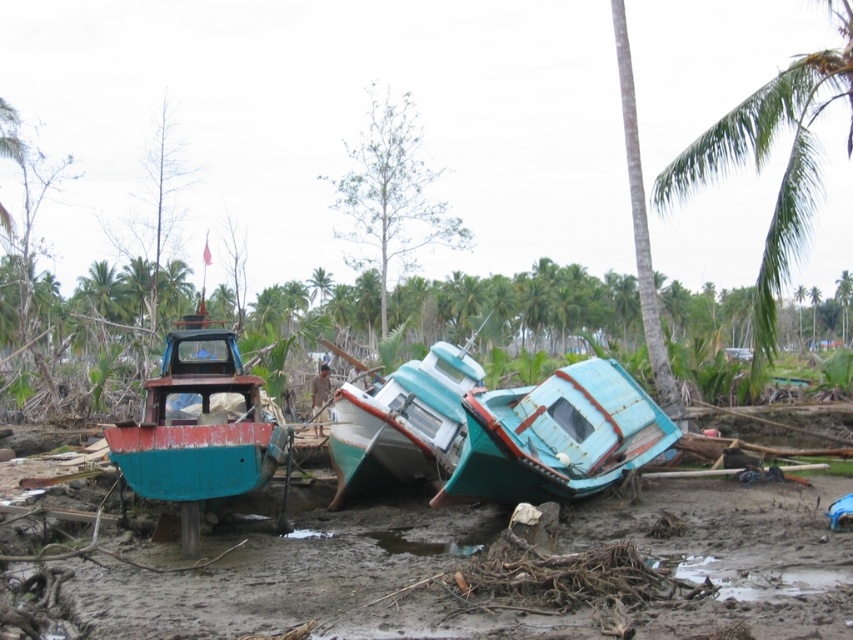
Question: Can you confirm if green leafy palm tree at upper right is thinner than green leafy palm tree at upper center?

Choices:
 (A) no
 (B) yes

Answer: (A)

Question: Which of the following is the farthest from the observer?

Choices:
 (A) green leafy palm tree at upper right
 (B) teal matte boat at center
 (C) rusty metal boat at left
 (D) green leafy palm tree at upper center

Answer: (D)

Question: Among these points, which one is nearest to the camera?

Choices:
 (A) (344, 448)
 (B) (714, 163)

Answer: (A)

Question: Does rusty teal boat at center have a greater width compared to teal matte boat at center?

Choices:
 (A) no
 (B) yes

Answer: (B)

Question: Which object is the closest to the green leafy palm tree at upper right?

Choices:
 (A) rusty metal boat at left
 (B) teal matte boat at center
 (C) green leafy palm tree at upper center
 (D) rusty teal boat at center

Answer: (D)

Question: Is rusty metal boat at left to the left of green leafy palm tree at upper center from the viewer's perspective?

Choices:
 (A) no
 (B) yes

Answer: (A)